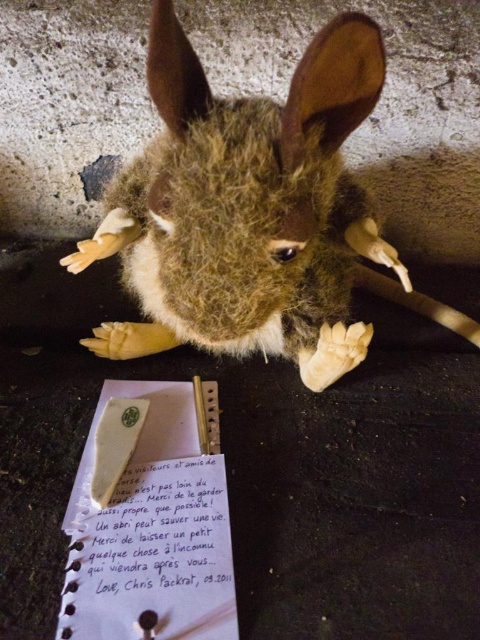
From the picture: You are a photographer trying to capture a closeup shot of the fuzzy fur rabbit at center. The camera you are using has a minimum focusing distance of 20 inches. Will you be able to take the photo without moving the rabbit?

The fuzzy fur rabbit at center is 26.06 inches from the camera. Since the minimum focusing distance is 20 inches, the camera can focus on the rabbit as long as it is at least 20 inches away. Therefore, you can take the photo without moving the rabbit.